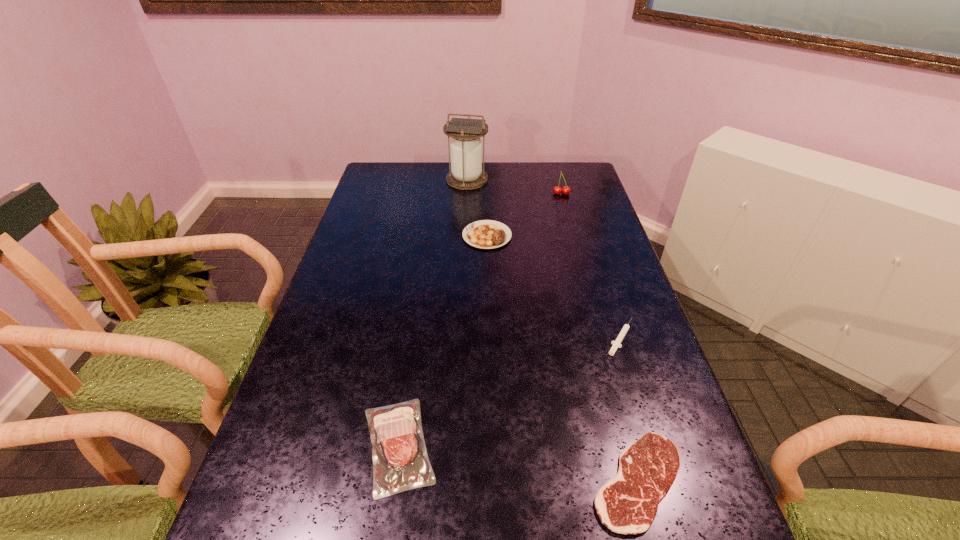
What are the coordinates of `the rightmost steak` in the screenshot? It's located at (627, 504).

Locate an element on the screen. The width and height of the screenshot is (960, 540). the shortest steak is located at coordinates (627, 504).

Identify the location of free point located 0.380m on the right of the lantern. The width and height of the screenshot is (960, 540). (585, 180).

Identify the location of vacant space located 0.130m with the stems of the cherry pointing upwards. The height and width of the screenshot is (540, 960). [x=567, y=215].

Find the location of a particular element. The width and height of the screenshot is (960, 540). vacant space located on the back of the farthest steak is located at coordinates (486, 171).

You are a GUI agent. You are given a task and a screenshot of the screen. Output one action in this format:
    pyautogui.click(x=<x>, y=<y>)
    Task: Click on the free space located 0.160m on the back of the leftmost steak
    The image size is (960, 540).
    Given the screenshot: What is the action you would take?
    pyautogui.click(x=414, y=344)

Where is `vacant region located 0.080m on the front of the syringe`? This screenshot has width=960, height=540. vacant region located 0.080m on the front of the syringe is located at coordinates (636, 384).

Locate an element on the screen. This screenshot has width=960, height=540. free spot located 0.120m on the back of the shortest steak is located at coordinates (612, 386).

You are a GUI agent. You are given a task and a screenshot of the screen. Output one action in this format:
    pyautogui.click(x=<x>, y=<y>)
    Task: Click on the lantern that is at the far edge
    This screenshot has height=540, width=960.
    Given the screenshot: What is the action you would take?
    pyautogui.click(x=466, y=173)

The width and height of the screenshot is (960, 540). I want to click on cherry located in the far edge section of the desktop, so click(557, 190).